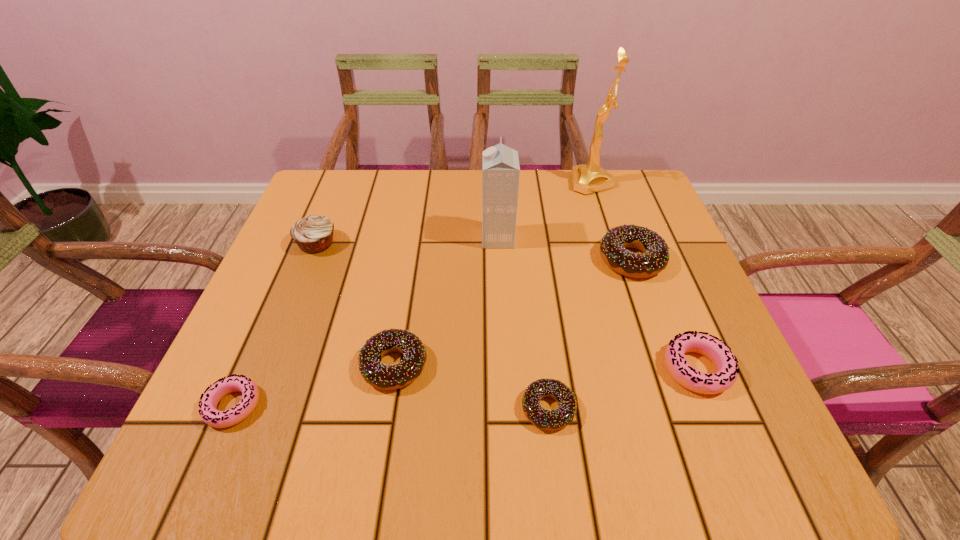
The height and width of the screenshot is (540, 960). I want to click on free spot between the smaller pink doughnut and the fifth shortest object, so click(432, 333).

What are the coordinates of `unoccupied area between the smaller pink doughnut and the rightmost chocolate doughnut` in the screenshot? It's located at (432, 333).

Image resolution: width=960 pixels, height=540 pixels. Find the location of `free spot between the fourth doughnut from right to left and the rightmost chocolate doughnut`. free spot between the fourth doughnut from right to left and the rightmost chocolate doughnut is located at coordinates (513, 312).

The height and width of the screenshot is (540, 960). I want to click on free space between the third doughnut from right to left and the tallest object, so (570, 295).

This screenshot has width=960, height=540. In order to click on blank region between the rightmost chocolate doughnut and the bigger pink doughnut in this screenshot , I will do `click(664, 314)`.

Locate an element on the screen. The image size is (960, 540). free space between the smaller pink doughnut and the second doughnut from left to right is located at coordinates (314, 386).

Identify the location of free space between the second smallest chocolate doughnut and the carton. (446, 302).

Where is `the fifth closest object relative to the bigger pink doughnut`? This screenshot has height=540, width=960. the fifth closest object relative to the bigger pink doughnut is located at coordinates (589, 178).

Select which object is the second closest to the farthest chocolate doughnut. Please provide its 2D coordinates. Your answer should be formatted as a tuple, i.e. [(x, y)], where the tuple contains the x and y coordinates of a point satisfying the conditions above.

[(589, 178)]

Choose which doughnut is the nearest neighbor to the second doughnut from left to right. Please provide its 2D coordinates. Your answer should be formatted as a tuple, i.e. [(x, y)], where the tuple contains the x and y coordinates of a point satisfying the conditions above.

[(208, 411)]